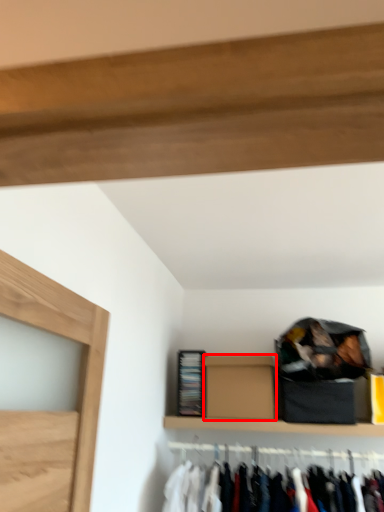
Question: From the image's perspective, where is box (annotated by the red box) located relative to cabinet?

Choices:
 (A) above
 (B) below

Answer: (A)